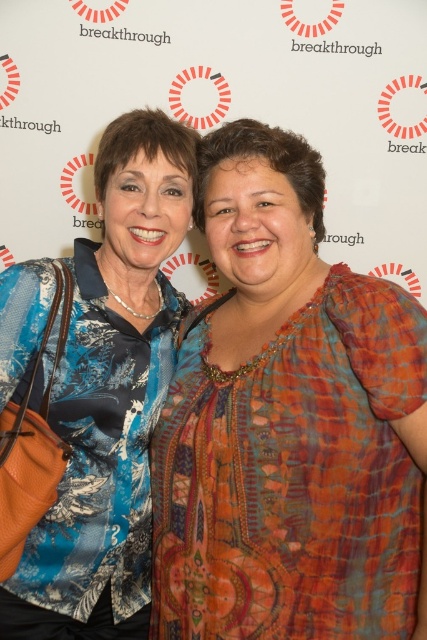
You are standing in front of the backdrop with the word breakthrough and need to place a small sticker on the spot that is closer to the camera between the two points, point (333, 625) and point (132, 275). Which point should you choose?

Point (333, 625) is in front of point (132, 275), so you should choose point (333, 625) as it is closer to the camera.

You are a photographer setting up for a portrait shoot. You need to position a spotlight so it illuminates both the textured orange blouse at center and the blue printed fabric at left. Given their positions, which direction should you aim the spotlight to ensure both are lit adequately?

The textured orange blouse at center is located below the blue printed fabric at left. To illuminate both, aim the spotlight downward from above the blue printed fabric at left towards the textured orange blouse at center so that both are evenly lit.